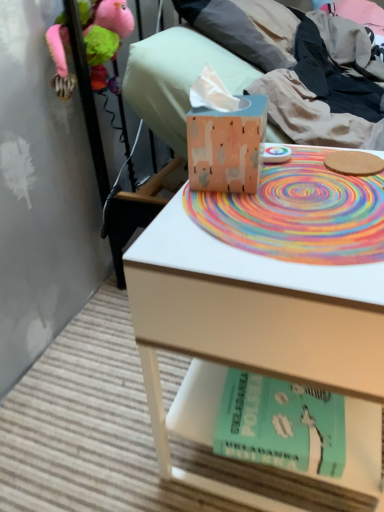
Question: In terms of height, does soft pink plush toy at upper left look taller or shorter compared to rainbow spiral mat at center?

Choices:
 (A) short
 (B) tall

Answer: (B)

Question: Is point (129, 16) closer or farther from the camera than point (258, 214)?

Choices:
 (A) closer
 (B) farther

Answer: (B)

Question: Considering the real-world distances, which object is farthest from the teal matte paperback book at lower center?

Choices:
 (A) wooden tissue box at center
 (B) wooden table at center
 (C) soft pink plush toy at upper left
 (D) matte cardboard tissue box at upper center
 (E) rainbow spiral mat at center

Answer: (C)

Question: Based on their relative distances, which object is nearer to the wooden table at center?

Choices:
 (A) matte cardboard tissue box at upper center
 (B) wooden tissue box at center
 (C) teal matte paperback book at lower center
 (D) rainbow spiral mat at center
 (E) soft pink plush toy at upper left

Answer: (D)